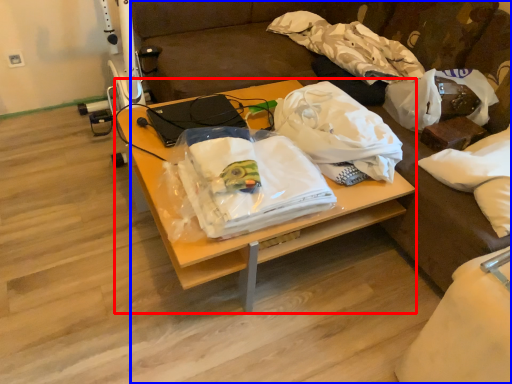
Question: Which object is further to the camera taking this photo, desk (highlighted by a red box) or studio couch (highlighted by a blue box)?

Choices:
 (A) desk
 (B) studio couch

Answer: (A)